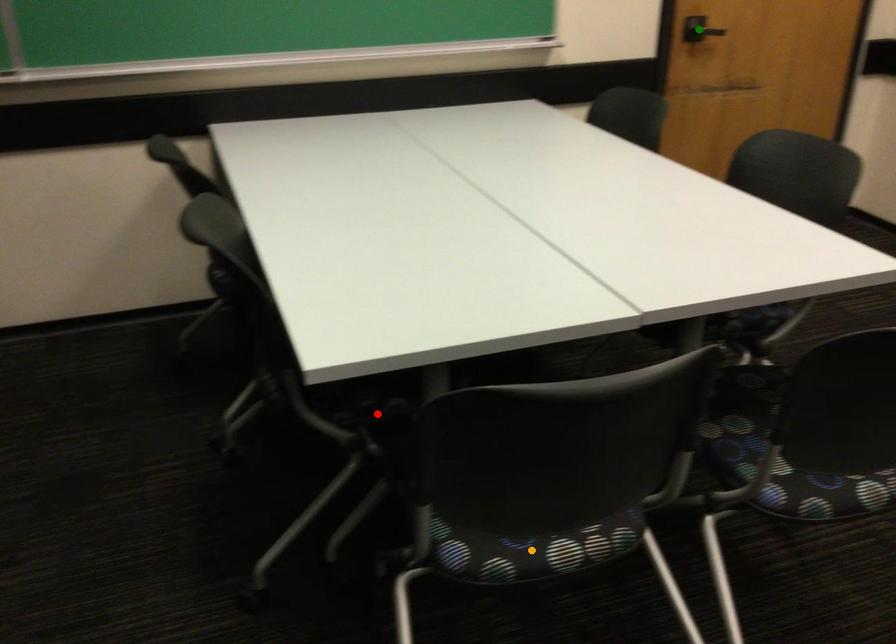
Order these from farthest to nearest:
green point
orange point
red point

green point, red point, orange point